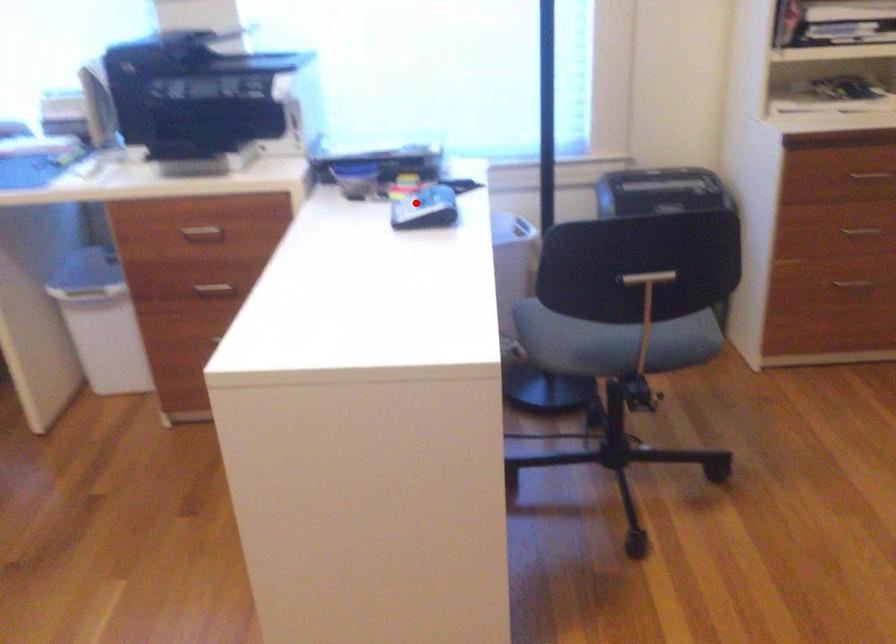
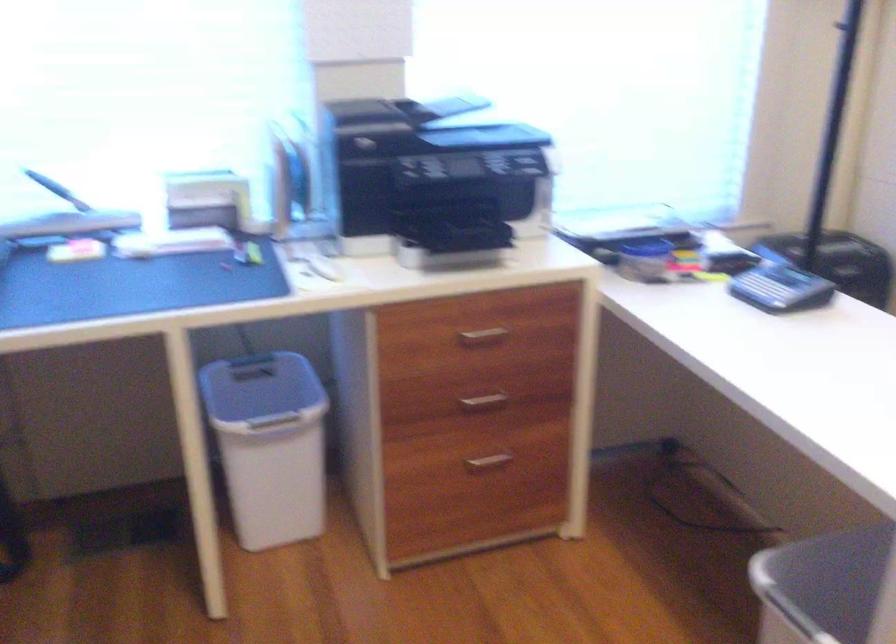
Question: I am providing you with two images of the same scene from different viewpoints. A red point is shown in image1. For the corresponding object point in image2, is it positioned nearer or farther from the camera?

Choices:
 (A) Nearer
 (B) Farther

Answer: (A)